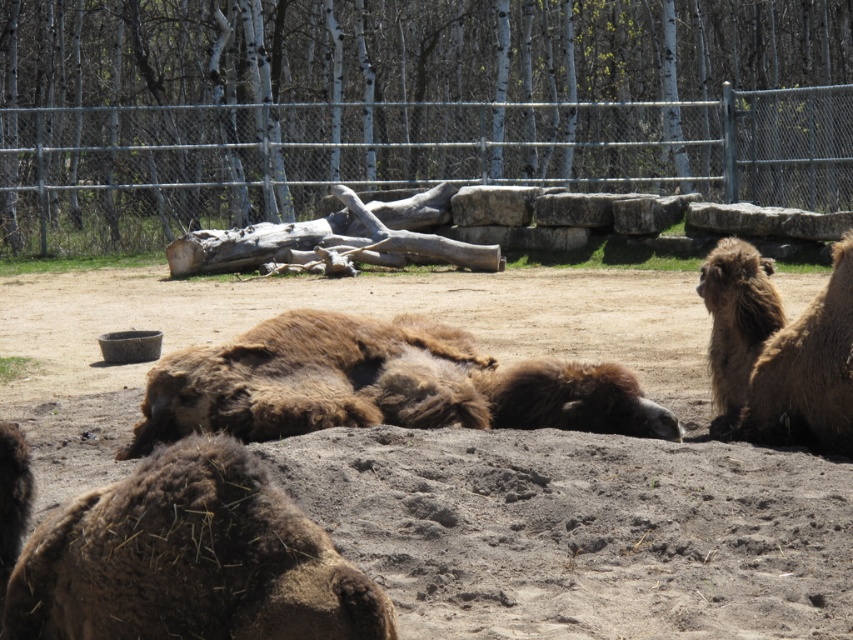
You are standing at the entrance of the zoo enclosure and want to take a photo of the camels. The camera you have can focus on objects up to 20 meters away. Is the point at coordinates point (711, 189) within the camera focus range?

The distance of point (711, 189) from the camera is 21.69 meters, which is beyond the camera focus range of 20 meters. Therefore, the point is out of focus range.

You are standing at the point marked as point (378, 385) in the zoo enclosure. What animal do you see directly in front of you?

At point (378, 385) lies brown fuzzy camel at center, so you see a brown fuzzy camel directly in front of you.

Consider the image. You are a zookeeper standing in front of the enclosure. You notice two points marked in the image. Which point, point (235, 365) or point (798, 417), is closer to you?

Point (235, 365) is closer to the camera than point (798, 417), so the point closer to you is point (235, 365).